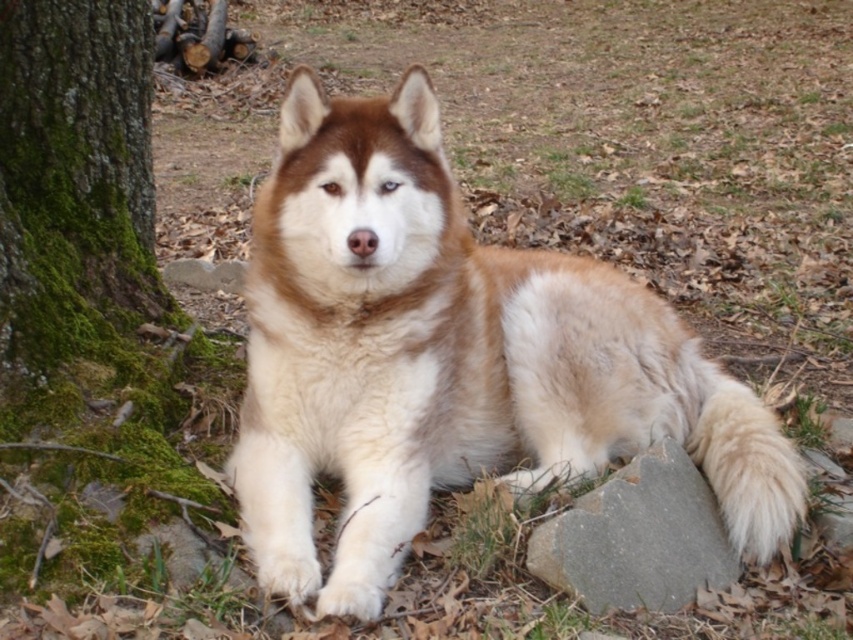
This screenshot has width=853, height=640. I want to click on brown and white fur dog at center, so click(x=450, y=358).

Can you confirm if brown and white fur dog at center is taller than green mossy bark at left?

Indeed, brown and white fur dog at center has a greater height compared to green mossy bark at left.

You are a GUI agent. You are given a task and a screenshot of the screen. Output one action in this format:
    pyautogui.click(x=<x>, y=<y>)
    Task: Click on the brown and white fur dog at center
    
    Given the screenshot: What is the action you would take?
    pyautogui.click(x=450, y=358)

The width and height of the screenshot is (853, 640). I want to click on brown and white fur dog at center, so click(450, 358).

Measure the distance between green mossy bark at left and gray smooth rock at lower right.

1.24 meters

Does point (67, 4) lie in front of point (680, 604)?

No.

At what (x,y) coordinates should I click in order to perform the action: click on green mossy bark at left. Please return your answer as a coordinate pair (x, y). This screenshot has width=853, height=640. Looking at the image, I should click on click(74, 179).

Between brown and white fur dog at center and gray smooth rock at lower right, which one is positioned higher?

brown and white fur dog at center is above.

Where is `brown and white fur dog at center`? This screenshot has height=640, width=853. brown and white fur dog at center is located at coordinates (450, 358).